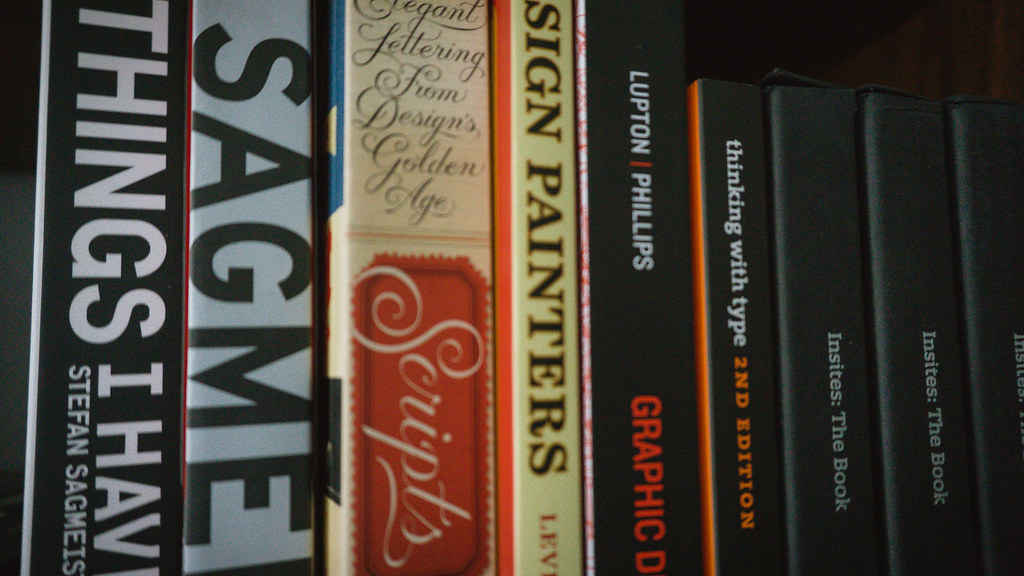
You are a GUI agent. You are given a task and a screenshot of the screen. Output one action in this format:
    pyautogui.click(x=<x>, y=<y>)
    Task: Click on the shelved books
    This screenshot has width=1024, height=576.
    Given the screenshot: What is the action you would take?
    pyautogui.click(x=117, y=244), pyautogui.click(x=255, y=252), pyautogui.click(x=421, y=257), pyautogui.click(x=542, y=257), pyautogui.click(x=633, y=274), pyautogui.click(x=742, y=281), pyautogui.click(x=835, y=282), pyautogui.click(x=910, y=280), pyautogui.click(x=1002, y=286)